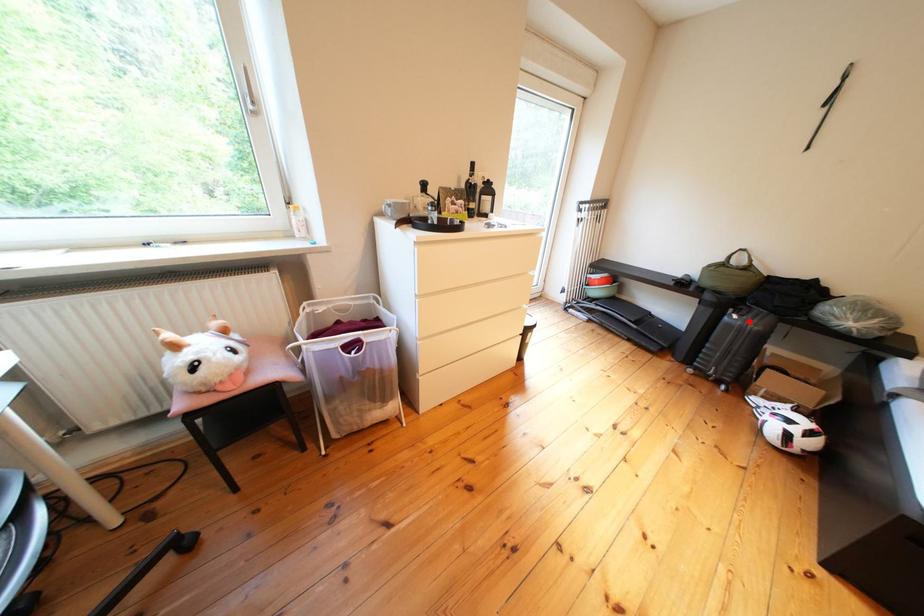
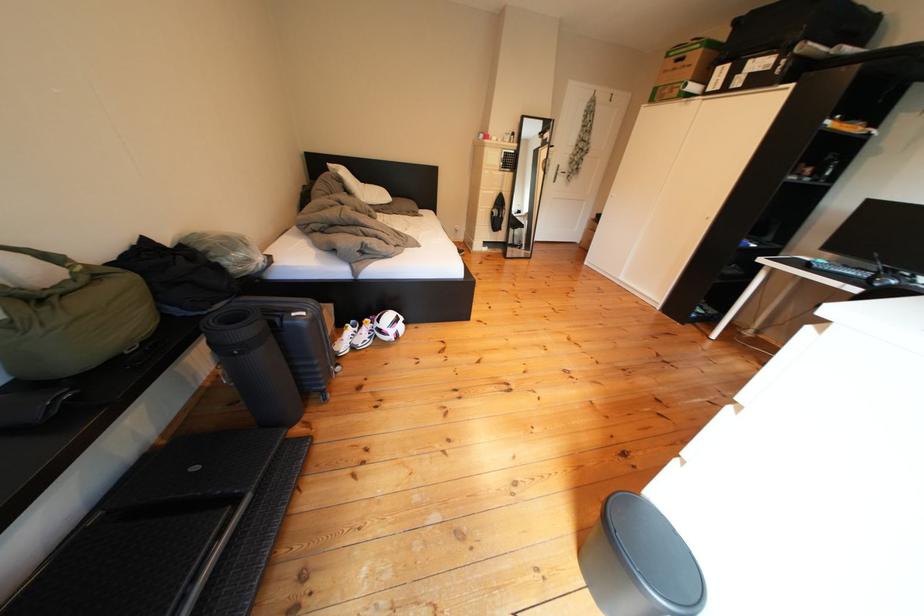
Question: I am providing you with two images of the same scene from different viewpoints. In image1, a red point is highlighted. Considering the same 3D point in image2, which of the following is correct?

Choices:
 (A) It is closer
 (B) It is farther

Answer: (A)